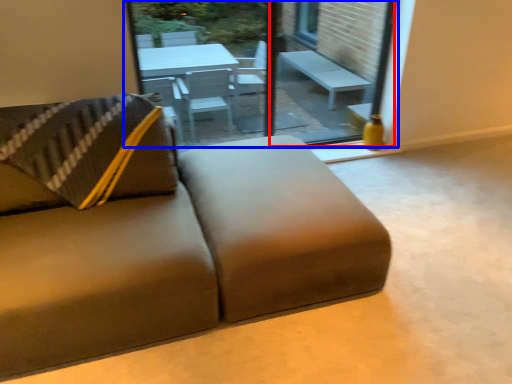
Question: Which object is further to the camera taking this photo, window screen (highlighted by a red box) or window (highlighted by a blue box)?

Choices:
 (A) window screen
 (B) window

Answer: (A)